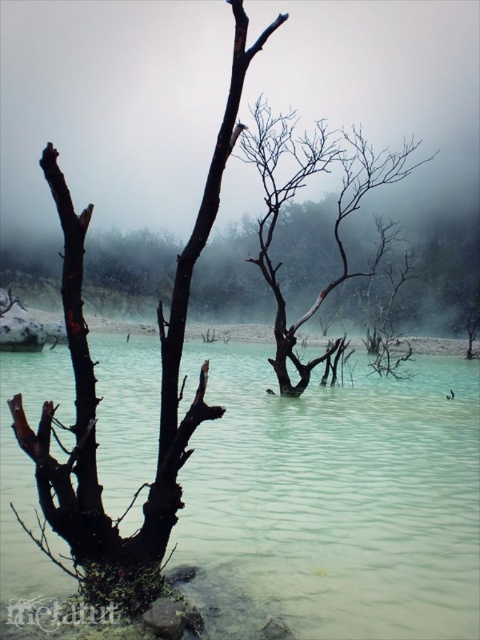
You are a hiker who wants to cross the green translucent water at center to reach the other side. However, there is a dark brown bark tree at left nearby. Based on their positions, do you think the tree might provide any shade over the water where you plan to walk?

The green translucent water at center is positioned under the dark brown bark tree at left, so the tree does cast shade over the water where you plan to walk.